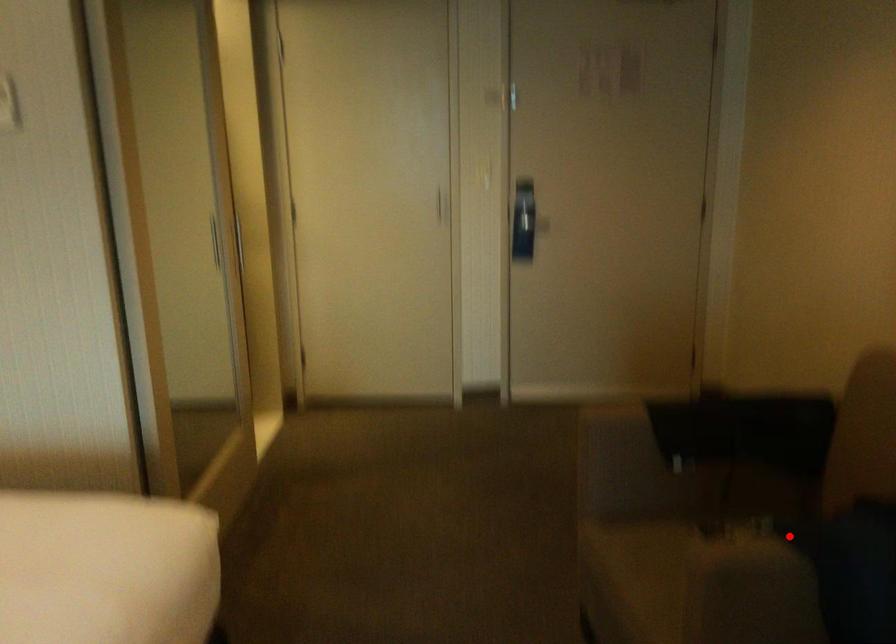
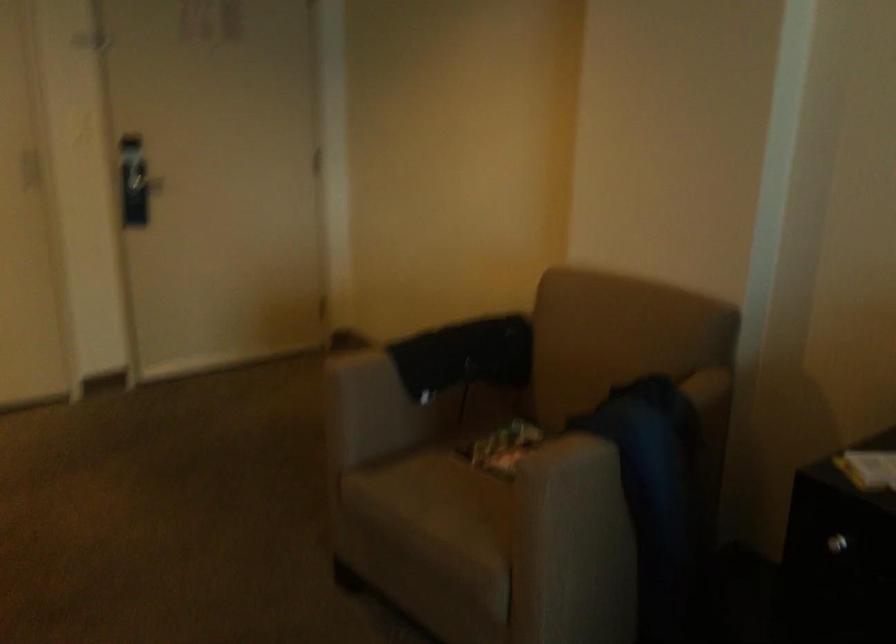
Question: I am providing you with two images of the same scene from different viewpoints. Image1 has a red point marked. In image2, the corresponding 3D location appears at what relative position? Reply with the corresponding letter.

Choices:
 (A) Closer
 (B) Farther

Answer: (B)